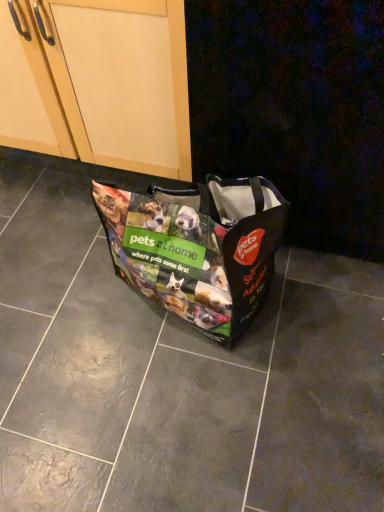
The image size is (384, 512). What are the coordinates of `vacant area to the right of polyester tote bag at center` in the screenshot? It's located at (322, 314).